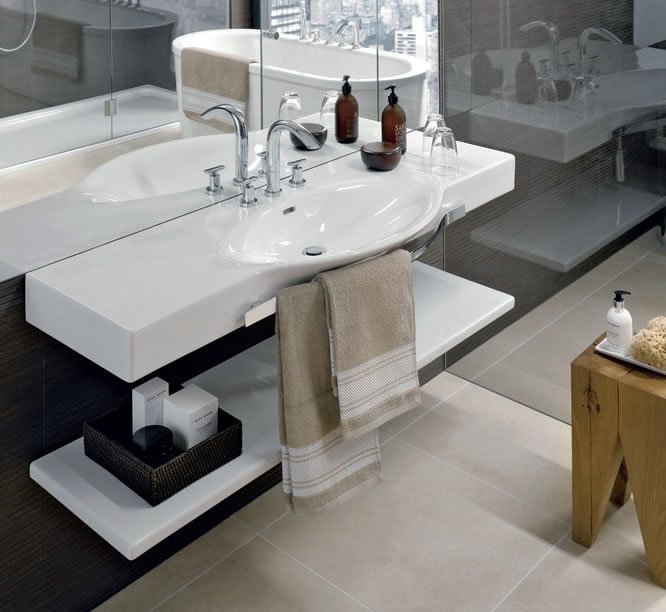
Identify the location of upside down glass. Image resolution: width=666 pixels, height=612 pixels. (452, 157).